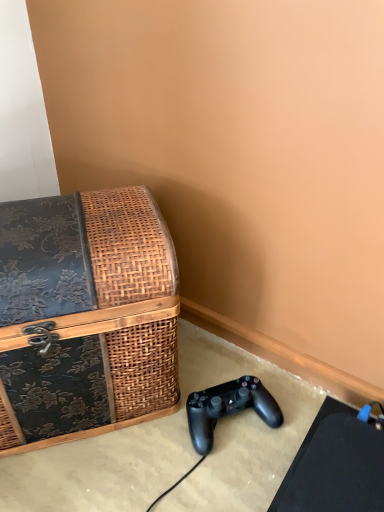
At what (x,y) coordinates should I click in order to perform the action: click on vacant space behind black matte game controller at lower right. Please return your answer as a coordinate pair (x, y). Looking at the image, I should click on (220, 361).